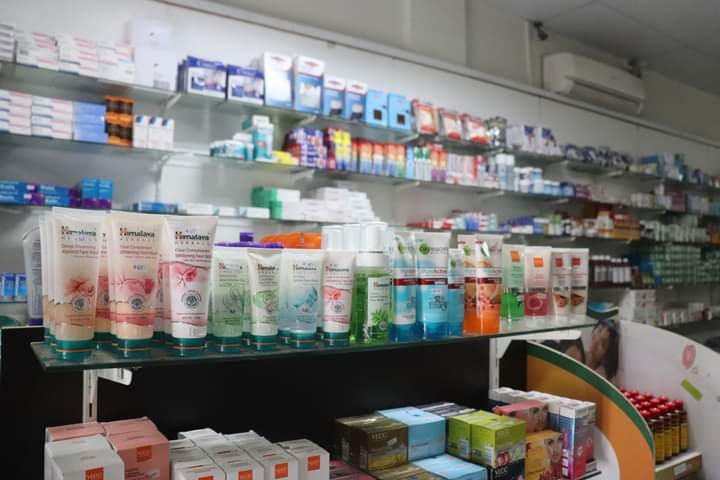
Where is `glass shel`? Image resolution: width=720 pixels, height=480 pixels. glass shel is located at coordinates (173, 359).